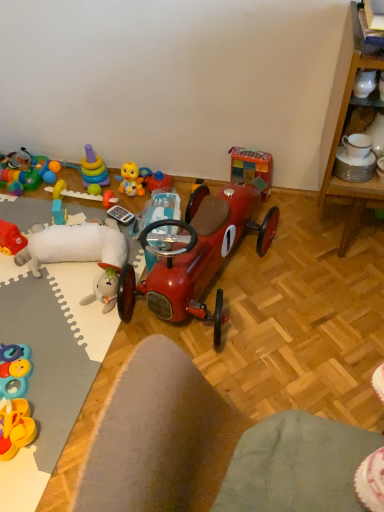
You are a GUI agent. You are given a task and a screenshot of the screen. Output one action in this format:
    pyautogui.click(x=<x>, y=<y>)
    Task: Click on the vacant space underneath shiny red car at center, the second toy from the right (from a real-world perspective)
    
    Given the screenshot: What is the action you would take?
    pyautogui.click(x=236, y=271)